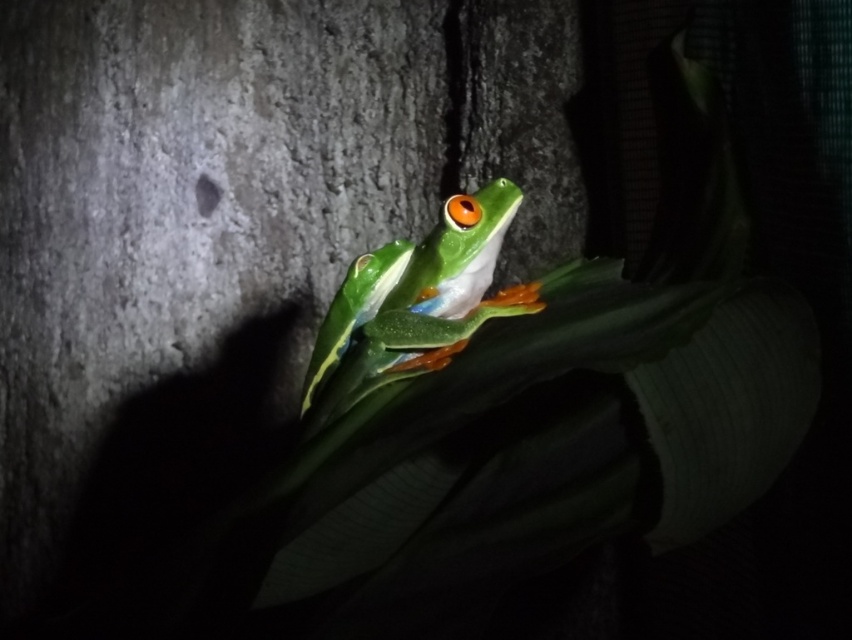
You are a painter standing 2 meters away from a rough bark tree trunk at center. Can you paint it without moving closer?

The rough bark tree trunk at center is 1.93 meters away from the viewer, so yes, you can paint it without moving closer since you are already within the required distance.

You are a small insect trying to move from the rough bark tree trunk at center to the green matte tree frog at center. Which direction should you go to reach the frog?

The green matte tree frog at center is located on the rough bark tree trunk at center, so you can move towards the frog by staying on the rough bark tree trunk at center.

You are an animal tracker observing the frog on the leaf. You notice a specific point in the image at coordinates point (226, 232). What object is located at that point?

The point (226, 232) corresponds to the rough bark tree trunk at center.